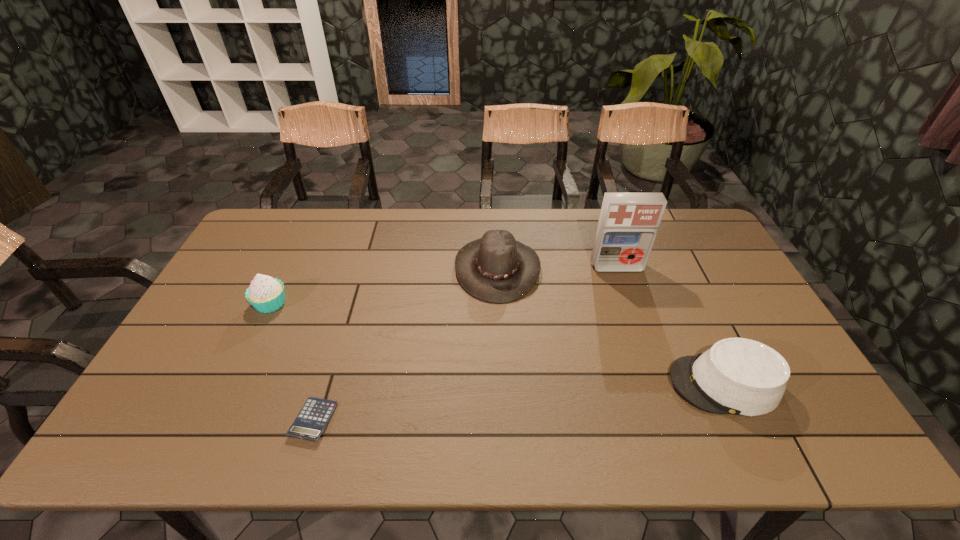
Where is `object located at the right edge`? This screenshot has height=540, width=960. object located at the right edge is located at coordinates (738, 376).

In the image, there is a desktop. What are the coordinates of `vacant area at the far edge` in the screenshot? It's located at (396, 210).

Locate an element on the screen. The height and width of the screenshot is (540, 960). vacant space at the left edge of the desktop is located at coordinates (254, 252).

Locate an element on the screen. Image resolution: width=960 pixels, height=540 pixels. vacant area at the right edge is located at coordinates (742, 302).

Where is `vacant area at the far right corner`? Image resolution: width=960 pixels, height=540 pixels. vacant area at the far right corner is located at coordinates (692, 219).

Where is `vacant space that is in between the first-aid kit and the third object from right to left`? The width and height of the screenshot is (960, 540). vacant space that is in between the first-aid kit and the third object from right to left is located at coordinates (557, 268).

Identify the location of empty space that is in between the third object from left to right and the calculator. (405, 345).

The height and width of the screenshot is (540, 960). I want to click on vacant space in between the first-aid kit and the right hat, so click(x=670, y=326).

Locate an element on the screen. This screenshot has width=960, height=540. vacant area between the cupcake and the right hat is located at coordinates (497, 343).

The image size is (960, 540). Identify the location of blank region between the leftmost object and the shorter hat. (497, 343).